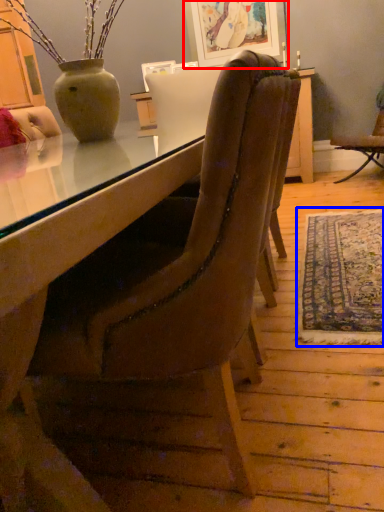
Question: Which of the following is the closest to the observer, picture frame (highlighted by a red box) or mat (highlighted by a blue box)?

Choices:
 (A) picture frame
 (B) mat

Answer: (B)